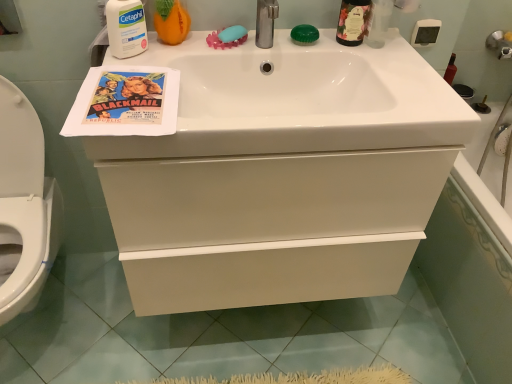
Question: Considering the relative sizes of white matte cetaphil at upper left, the first cleaning product positioned from the left, and white glossy sink at upper center in the image provided, is white matte cetaphil at upper left, the first cleaning product positioned from the left, smaller than white glossy sink at upper center?

Choices:
 (A) yes
 (B) no

Answer: (A)

Question: Is white matte cetaphil at upper left, which appears as the second cleaning product when viewed from the right, bigger than white glossy sink at upper center?

Choices:
 (A) no
 (B) yes

Answer: (A)

Question: Is white matte cetaphil at upper left, which appears as the second cleaning product when viewed from the right, at the left side of white glossy sink at upper center?

Choices:
 (A) no
 (B) yes

Answer: (B)

Question: Is white matte cetaphil at upper left, the first cleaning product positioned from the left, further to the viewer compared to white glossy sink at upper center?

Choices:
 (A) no
 (B) yes

Answer: (B)

Question: Considering the relative sizes of white matte cetaphil at upper left, the first cleaning product positioned from the left, and white glossy sink at upper center in the image provided, is white matte cetaphil at upper left, the first cleaning product positioned from the left, thinner than white glossy sink at upper center?

Choices:
 (A) no
 (B) yes

Answer: (B)

Question: Is white matte cetaphil at upper left, which appears as the second cleaning product when viewed from the right, shorter than white glossy sink at upper center?

Choices:
 (A) yes
 (B) no

Answer: (B)

Question: From a real-world perspective, does blue rubber soap at upper center, the 1th soap viewed from the left, stand above matte orange pumpkin at upper left, the 2th cleaning product from the left?

Choices:
 (A) yes
 (B) no

Answer: (B)

Question: Is blue rubber soap at upper center, which is the 2th soap from right to left, thinner than matte orange pumpkin at upper left, the 2th cleaning product from the left?

Choices:
 (A) yes
 (B) no

Answer: (A)

Question: From the image's perspective, is blue rubber soap at upper center, the 1th soap viewed from the left, over matte orange pumpkin at upper left, the first cleaning product positioned from the right?

Choices:
 (A) no
 (B) yes

Answer: (A)

Question: Can you confirm if blue rubber soap at upper center, the 1th soap viewed from the left, is wider than matte orange pumpkin at upper left, the 2th cleaning product from the left?

Choices:
 (A) yes
 (B) no

Answer: (B)

Question: Is blue rubber soap at upper center, the 1th soap viewed from the left, positioned in front of matte orange pumpkin at upper left, the 2th cleaning product from the left?

Choices:
 (A) yes
 (B) no

Answer: (B)

Question: Is blue rubber soap at upper center, the 1th soap viewed from the left, outside matte orange pumpkin at upper left, the first cleaning product positioned from the right?

Choices:
 (A) yes
 (B) no

Answer: (A)

Question: Is green glass bottle at upper right shorter than white glossy sink at upper center?

Choices:
 (A) no
 (B) yes

Answer: (A)